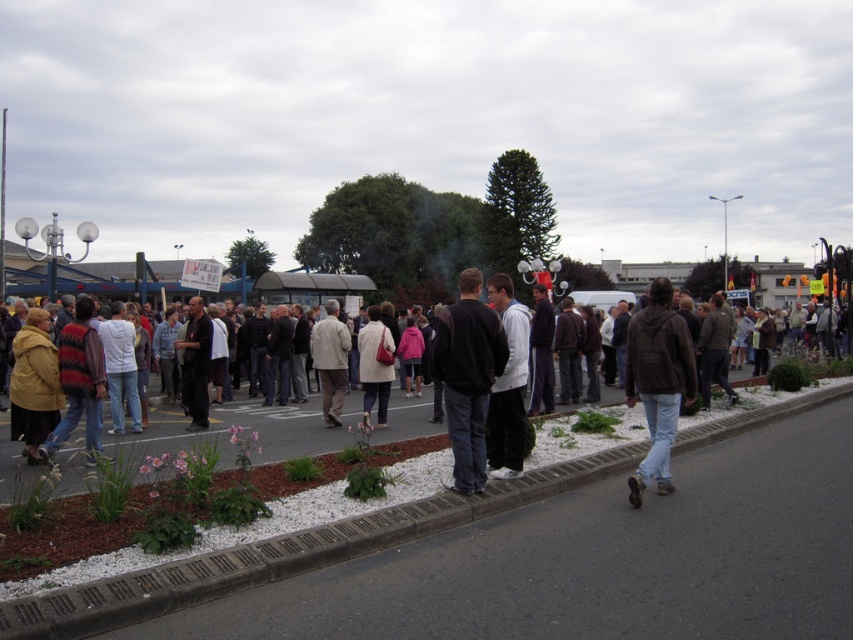
Looking at this image, who is shorter, dark brown sweater at center or brown leather jacket at lower right?

dark brown sweater at center

Does dark brown sweater at center have a larger size compared to brown leather jacket at lower right?

No.

Which is behind, point (480, 332) or point (651, 419)?

The point (651, 419) is more distant.

What are the coordinates of `dark brown sweater at center` in the screenshot? It's located at (467, 376).

Can you confirm if smooth concrete pavement at center is positioned below dark gray hoodie at center?

Correct, smooth concrete pavement at center is located below dark gray hoodie at center.

Who is positioned more to the right, smooth concrete pavement at center or dark gray hoodie at center?

smooth concrete pavement at center is more to the right.

Is point (132, 582) positioned behind point (512, 449)?

No, it is not.

Find the location of a particular element. Image resolution: width=853 pixels, height=640 pixels. smooth concrete pavement at center is located at coordinates (282, 554).

Is point (666, 305) farther from viewer compared to point (386, 333)?

No, (666, 305) is closer to viewer.

Consider the image. Who is more distant from viewer, (670, 428) or (393, 378)?

The point (393, 378) is more distant.

Where is `brown leather jacket at lower right`? This screenshot has width=853, height=640. brown leather jacket at lower right is located at coordinates (659, 381).